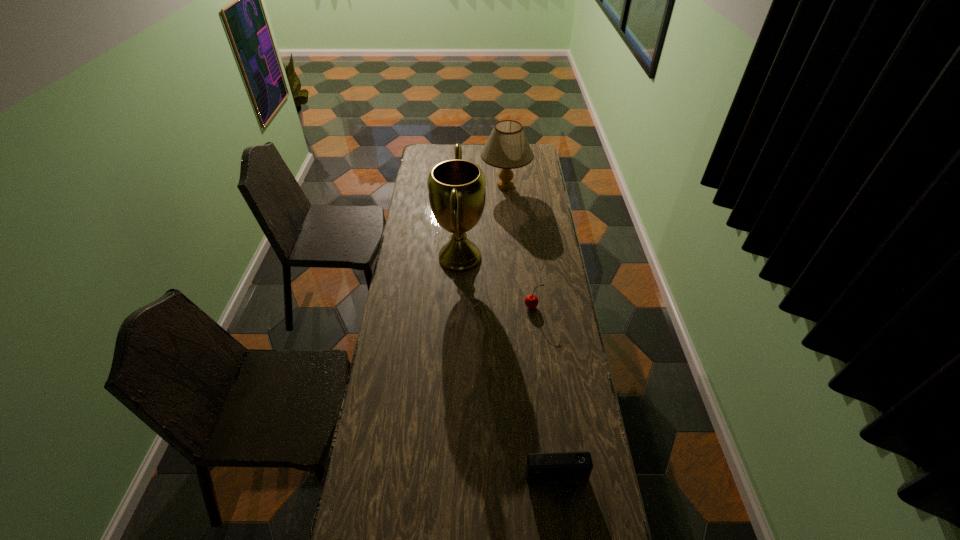
Find the location of `lampshade situated at the right edge`. lampshade situated at the right edge is located at coordinates (507, 147).

You are a GUI agent. You are given a task and a screenshot of the screen. Output one action in this format:
    pyautogui.click(x=<x>, y=<y>)
    Task: Click on the camera located in the right edge section of the desktop
    This screenshot has width=960, height=540.
    Given the screenshot: What is the action you would take?
    pyautogui.click(x=567, y=469)

Where is `cherry located at the right edge`? The image size is (960, 540). cherry located at the right edge is located at coordinates (531, 301).

Locate an element on the screen. The width and height of the screenshot is (960, 540). free space at the far edge of the desktop is located at coordinates (468, 159).

Locate an element on the screen. This screenshot has height=540, width=960. vacant area at the left edge of the desktop is located at coordinates (386, 495).

Find the location of `vacant space at the right edge of the desktop`. vacant space at the right edge of the desktop is located at coordinates (535, 211).

The width and height of the screenshot is (960, 540). Find the location of `free area in between the camera and the tallest object`. free area in between the camera and the tallest object is located at coordinates (508, 369).

Where is `free space that is in between the trophy cup and the camera`? The height and width of the screenshot is (540, 960). free space that is in between the trophy cup and the camera is located at coordinates (508, 369).

The width and height of the screenshot is (960, 540). Find the location of `blank region between the nearest object and the cherry`. blank region between the nearest object and the cherry is located at coordinates (544, 394).

What are the coordinates of `free space between the farthest object and the nearest object` in the screenshot? It's located at (531, 334).